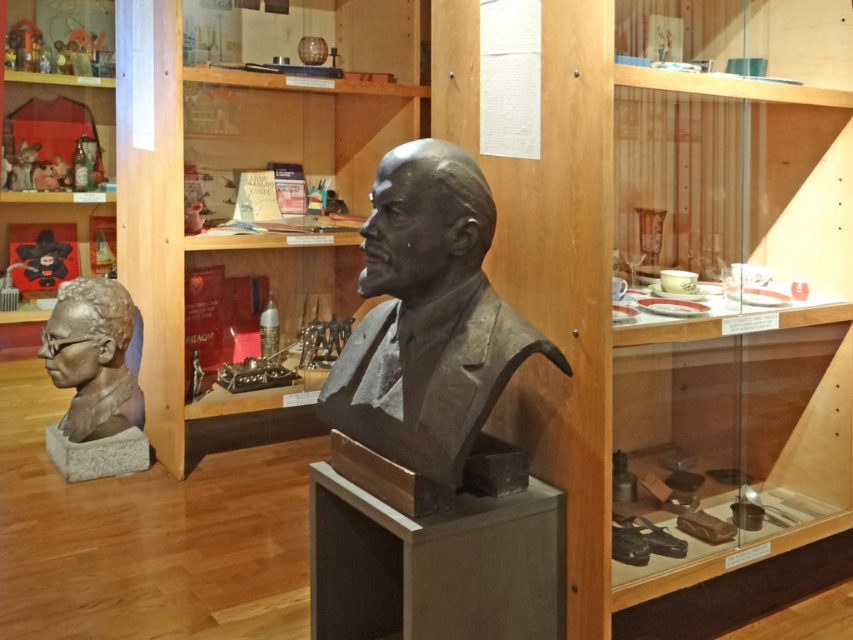
You are an art curator planning to move a new sculpture to this display area. The sculpture is 1.8 meters tall. Based on the scene, can the wooden bookshelf at center support the sculpture vertically without it exceeding the height of the slate gray stone bust at center?

The wooden bookshelf at center is taller than the slate gray stone bust at center. Since the sculpture is 1.8 meters tall, if the bookshelf is taller than the bust, the sculpture might exceed the bust height. However, without exact measurements, it is uncertain. Please check the bookshelf height first.

You are an art curator planning to install a new lighting system in the exhibit. The lighting fixtures are designed to accommodate items up to 1.2 meters in height. Given the slate gray stone bust at center and the satin silver bust at center, which one requires special consideration for the lighting height?

The slate gray stone bust at center requires special consideration because it has a greater height compared to the satin silver bust at center, so the lighting must be adjusted to accommodate its height.